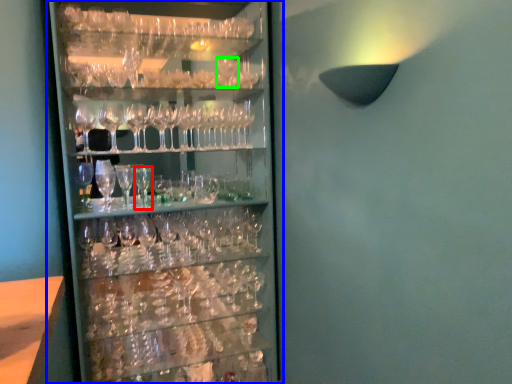
Question: Which is farther away from beer glass (highlighted by a red box)? shelf (highlighted by a blue box) or wine glass (highlighted by a green box)?

Choices:
 (A) shelf
 (B) wine glass

Answer: (B)